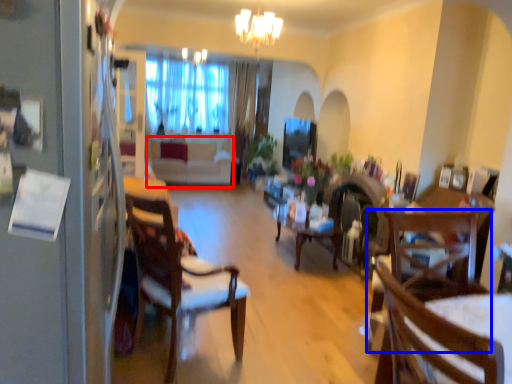
Question: Which object is closer to the camera taking this photo, couch (highlighted by a red box) or chair (highlighted by a blue box)?

Choices:
 (A) couch
 (B) chair

Answer: (B)